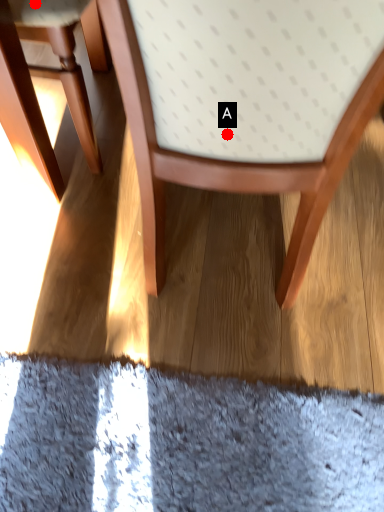
Question: Two points are circled on the image, labeled by A and B beside each circle. Which of the following is the closest to the observer?

Choices:
 (A) A is closer
 (B) B is closer

Answer: (A)